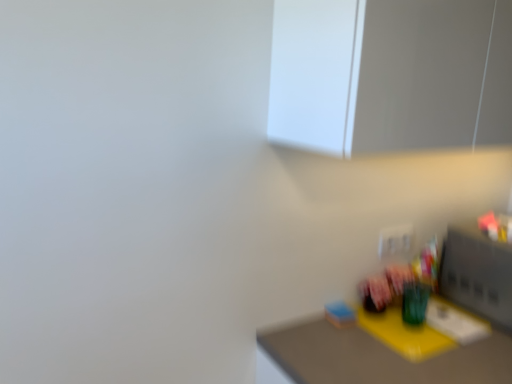
Question: In terms of width, does yellow matte table at lower right look wider or thinner when compared to white glossy medicine cabinet at upper center?

Choices:
 (A) thin
 (B) wide

Answer: (B)

Question: In the image, is yellow matte table at lower right positioned in front of or behind white glossy medicine cabinet at upper center?

Choices:
 (A) front
 (B) behind

Answer: (B)

Question: Considering the relative positions of yellow matte table at lower right and white glossy medicine cabinet at upper center in the image provided, is yellow matte table at lower right to the left or to the right of white glossy medicine cabinet at upper center?

Choices:
 (A) right
 (B) left

Answer: (A)

Question: From the image's perspective, is white glossy medicine cabinet at upper center located above or below yellow matte table at lower right?

Choices:
 (A) above
 (B) below

Answer: (A)

Question: Is white glossy medicine cabinet at upper center inside the boundaries of yellow matte table at lower right, or outside?

Choices:
 (A) inside
 (B) outside

Answer: (B)

Question: In terms of width, does white glossy medicine cabinet at upper center look wider or thinner when compared to yellow matte table at lower right?

Choices:
 (A) thin
 (B) wide

Answer: (A)

Question: In terms of size, does white glossy medicine cabinet at upper center appear bigger or smaller than yellow matte table at lower right?

Choices:
 (A) small
 (B) big

Answer: (A)